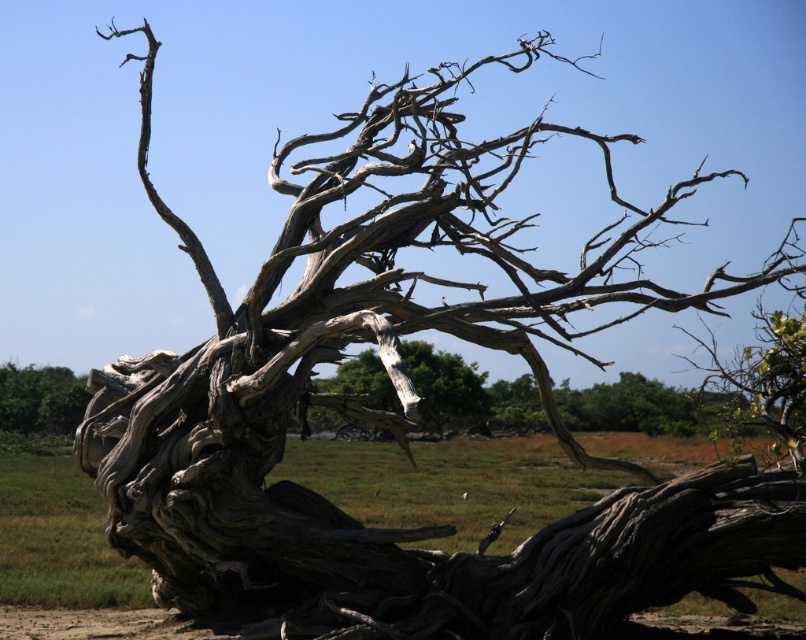
You are an artist sketching the scene of the gray textured driftwood at center and the gray rough bark tree at center. Which object should you draw first if you want to follow the natural order from bottom to top?

You should draw the gray textured driftwood at center first because it is positioned below the gray rough bark tree at center, following the bottom to top order.

Looking at this image, you are standing in a garden and want to take a closer look at both the gray textured driftwood at center and the gray rough bark tree at lower left. Which object will you reach first as you move forward?

You will reach the gray textured driftwood at center first because it is closer to the viewer than the gray rough bark tree at lower left.

You are standing at the base of the dead tree and want to walk towards the point labeled point (604, 428). Will you pass by point (40, 412) on your way there?

No, because point (604, 428) is in front of point (40, 412), so you would reach point (604, 428) before reaching point (40, 412).